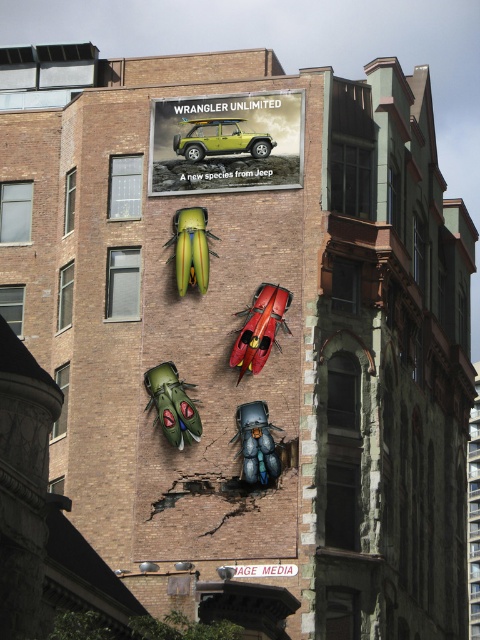
Question: Which object is closer to the camera taking this photo?

Choices:
 (A) metallic red car at center
 (B) matte green plastic car at upper center
 (C) green glossy beetle at center
 (D) matte green plastic jeep at upper center

Answer: (A)

Question: Can you confirm if matte green plastic car at upper center is wider than blue metallic beetle at center?

Choices:
 (A) no
 (B) yes

Answer: (B)

Question: Can you confirm if matte green plastic jeep at upper center is wider than green metallic beetle at center?

Choices:
 (A) yes
 (B) no

Answer: (A)

Question: Which of these objects is positioned closest to the blue metallic beetle at center?

Choices:
 (A) metallic red car at center
 (B) matte green plastic jeep at upper center
 (C) green glossy beetle at center

Answer: (A)

Question: Can you confirm if metallic red car at center is positioned to the left of blue metallic beetle at center?

Choices:
 (A) no
 (B) yes

Answer: (A)

Question: Which of the following is the closest to the observer?

Choices:
 (A) (206, 280)
 (B) (245, 116)

Answer: (A)